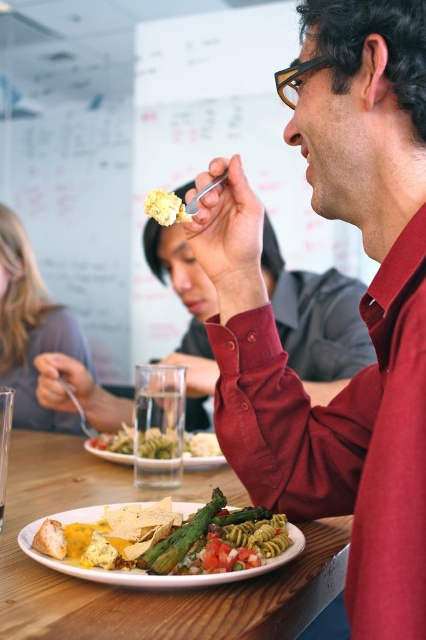
The image size is (426, 640). What do you see at coordinates (359, 307) in the screenshot?
I see `matte red shirt at upper right` at bounding box center [359, 307].

Between matte red shirt at upper right and yellow crumbly at upper center, which one is positioned higher?

yellow crumbly at upper center is higher up.

Between point (377, 454) and point (149, 209), which one is positioned in front?

Point (377, 454)

Image resolution: width=426 pixels, height=640 pixels. I want to click on matte red shirt at upper right, so click(359, 307).

Who is more forward, (0, 333) or (117, 582)?

Point (117, 582) is in front.

In the scene shown: Is matte gray sweater at upper left in front of matte yellow plate with pasta and vegetables at center?

That is False.

Does point (25, 346) come farther from viewer compared to point (192, 508)?

Yes, it is.

Find the location of a particular element. The width and height of the screenshot is (426, 640). matte gray sweater at upper left is located at coordinates (31, 330).

Can you confirm if matte red shirt at upper right is positioned above green asparagus at center?

Yes.

Is matte red shirt at upper right wider than green asparagus at center?

Correct, the width of matte red shirt at upper right exceeds that of green asparagus at center.

Which is in front, point (388, 54) or point (189, 451)?

Point (388, 54) is more forward.

Image resolution: width=426 pixels, height=640 pixels. Find the location of `matte red shirt at upper right`. matte red shirt at upper right is located at coordinates (359, 307).